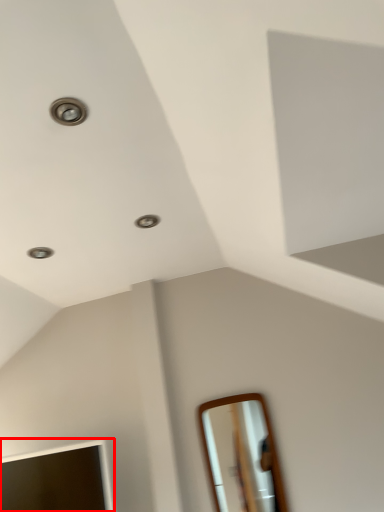
Question: From the image's perspective, where is mirror (annotated by the red box) located in relation to mirror in the image?

Choices:
 (A) above
 (B) below

Answer: (B)